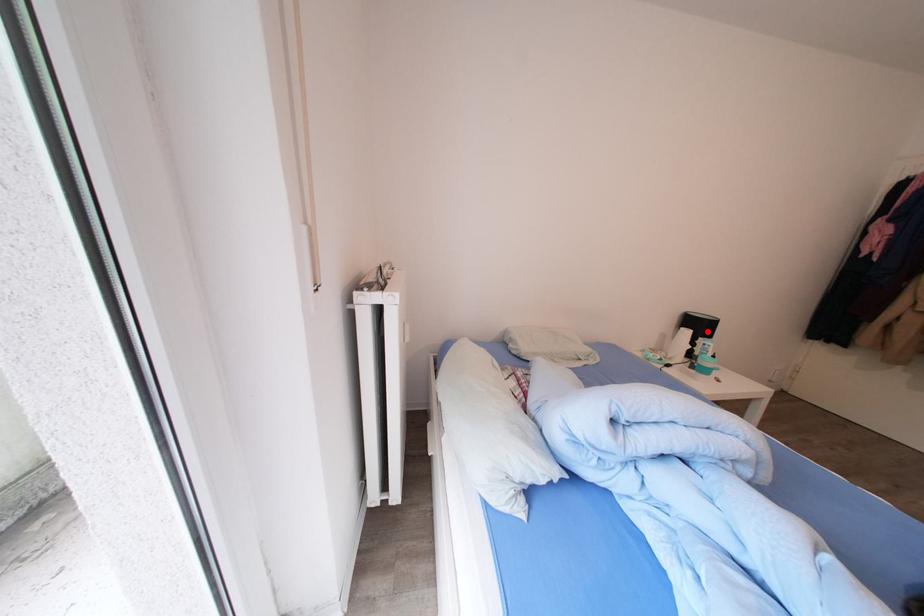
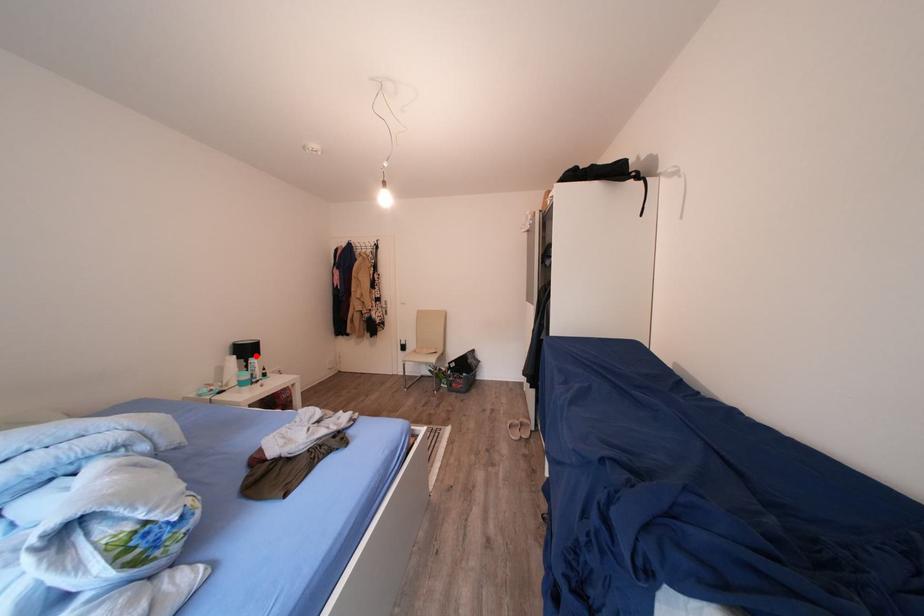
I am providing you with two images of the same scene from different viewpoints. A red point is marked on the first image and another point is marked on the second image. Is the red point in image1 aligned with the point shown in image2?

Yes